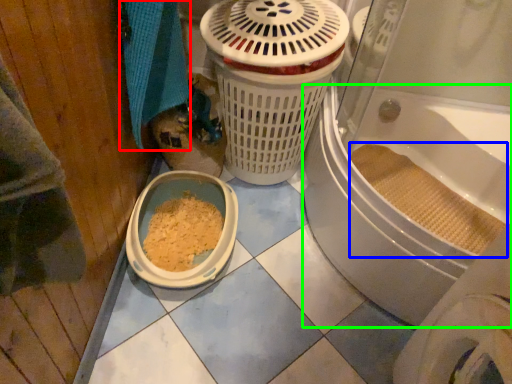
Question: Based on their relative distances, which object is nearer to bath towel (highlighted by a red box)? Choose from debris (highlighted by a blue box) and bath (highlighted by a green box).

Choices:
 (A) debris
 (B) bath

Answer: (B)